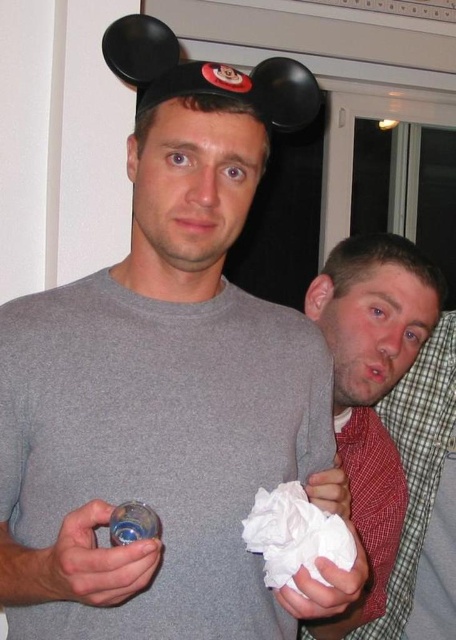
You are at a party and see two people. The first person is wearing a gray tshirt and black Mickey Mouse hat with large round ears and a red circular patch with a smiling face in the center. They are holding a small clear plastic bottle in their left hand and a crumpled white paper towel in their right. The second person is partially hidden but wearing a checkered shirt with a red undershirt. They are leaning towards the first person. There is a point marked at coordinates (x=372, y=387). What object is at the

The point at coordinates (x=372, y=387) indicates the red plaid tie at right.

You are a photographer setting up for a group photo. You want to ensure that both the red plaid tie at right and the white crumpled paper at lower center are visible in the frame. Given their distance apart, what is the minimum focal length you should use to capture both objects without distortion?

The minimum focal length required to capture both the red plaid tie at right and the white crumpled paper at lower center, which are 18.37 inches apart, depends on the camera sensor size and desired field of view. However, a focal length between 35mm to 50mm is typically suitable for group photos to avoid distortion while including subjects at this distance.

You are organizing a small party and need to decide where to place decorations. If you have a red plaid tie at right and a white crumpled paper at lower center, which object is bigger and should be placed in a more prominent location?

The red plaid tie at right is larger in size compared to the white crumpled paper at lower center, so it should be placed in a more prominent location.